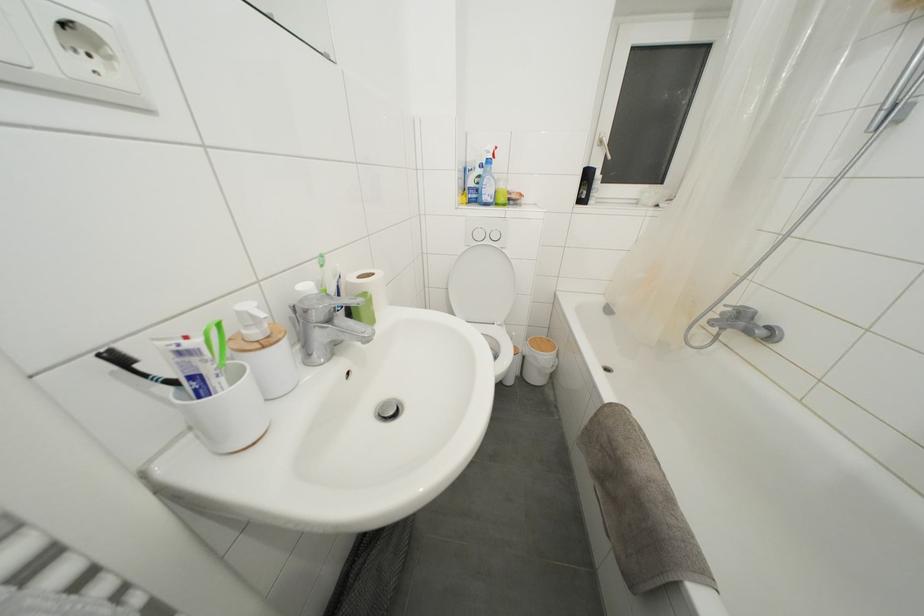
Where would you pull the white window handle? Please return your answer as a coordinate pair (x, y).

(603, 147)